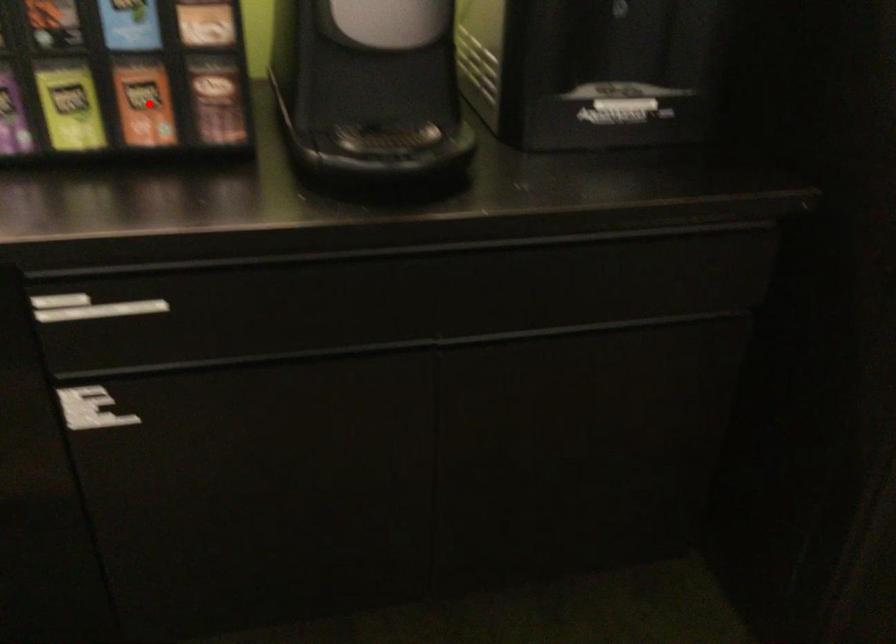
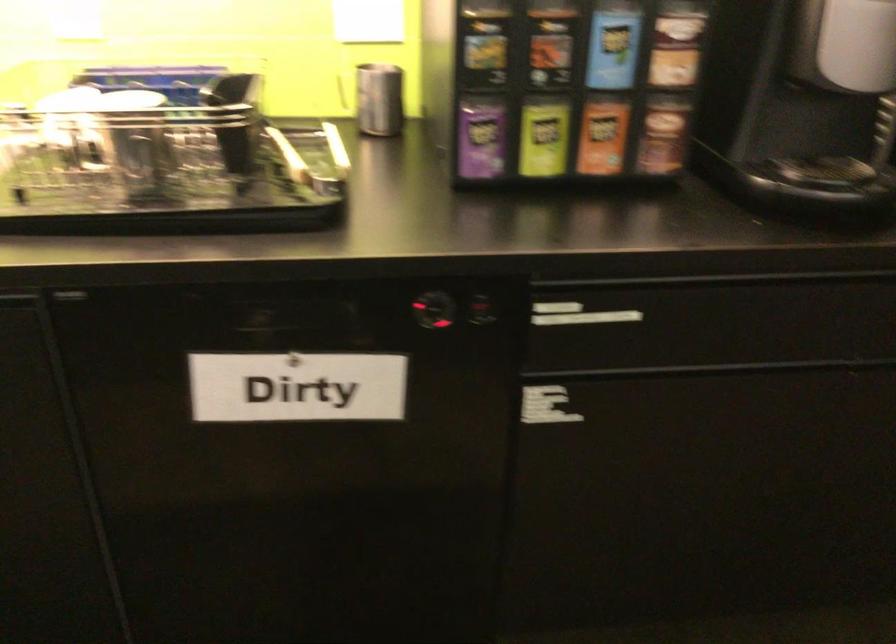
Question: I am providing you with two images of the same scene from different viewpoints. Given a red point in image1, look at the same physical point in image2. Is it:

Choices:
 (A) Closer to the viewpoint
 (B) Farther from the viewpoint

Answer: (B)